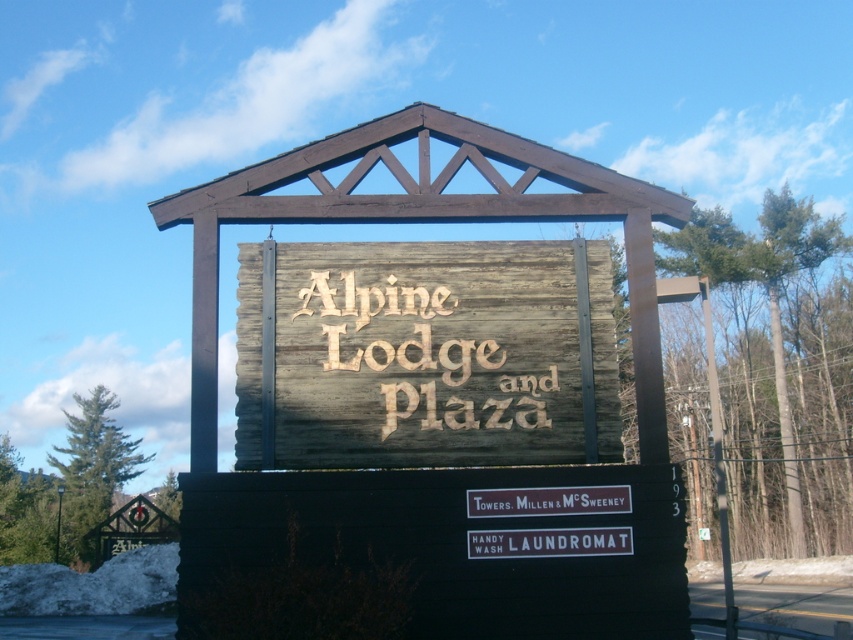
Question: From the image, what is the correct spatial relationship of weathered wood sign at center in relation to brown wood sign at center?

Choices:
 (A) right
 (B) left

Answer: (B)

Question: Does weathered wood sign at center have a greater width compared to brown wood sign at center?

Choices:
 (A) yes
 (B) no

Answer: (A)

Question: Can you confirm if weathered wood sign at center is wider than brown wood sign at center?

Choices:
 (A) yes
 (B) no

Answer: (A)

Question: Which point is farther to the camera?

Choices:
 (A) (236, 388)
 (B) (625, 502)

Answer: (A)